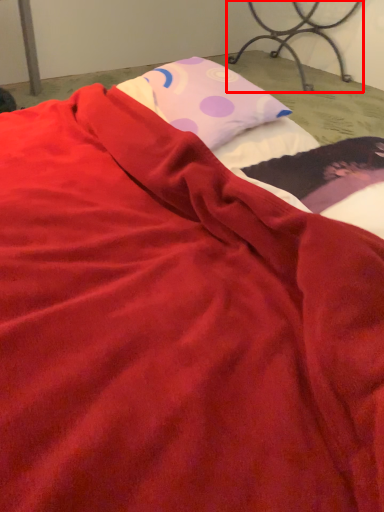
Question: From the image's perspective, where is furniture (annotated by the red box) located relative to pillow?

Choices:
 (A) above
 (B) below

Answer: (A)